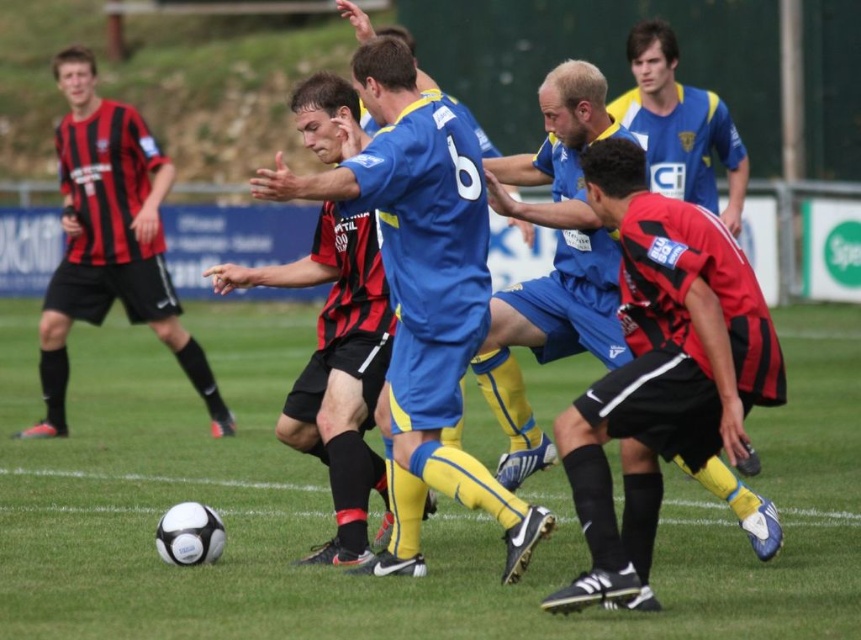
You are a referee observing the soccer match. You need to determine if the player in the red and black jersey at center can reach the ball over the head of the black jersey at left. Based on their heights, what do you think?

The red and black jersey at center is not as tall as the black jersey at left, so the player in the red and black jersey at center may have difficulty reaching the ball over the head of the black jersey at left due to their shorter height.